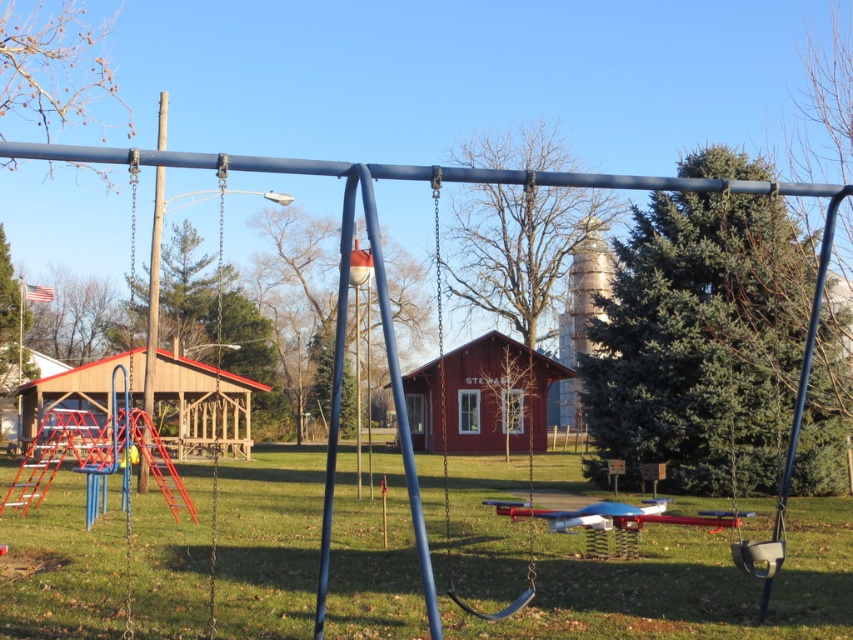
Question: Is green grass at center closer to camera compared to metallic swing at center?

Choices:
 (A) no
 (B) yes

Answer: (A)

Question: Which point is farther to the camera?

Choices:
 (A) (183, 556)
 (B) (515, 604)

Answer: (A)

Question: Can you confirm if green grass at center is positioned above metallic swing at center?

Choices:
 (A) no
 (B) yes

Answer: (A)

Question: Which of the following is the closest to the observer?

Choices:
 (A) metallic swing at center
 (B) green grass at center

Answer: (A)

Question: Which point is closer to the camera?

Choices:
 (A) (439, 372)
 (B) (807, 634)

Answer: (B)

Question: Does green grass at center have a greater width compared to metallic swing at center?

Choices:
 (A) yes
 (B) no

Answer: (A)